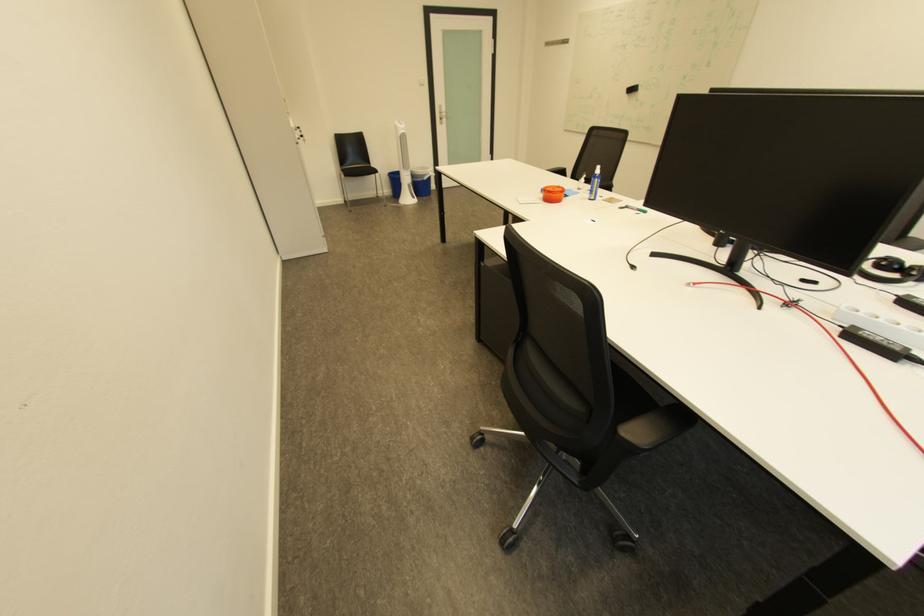
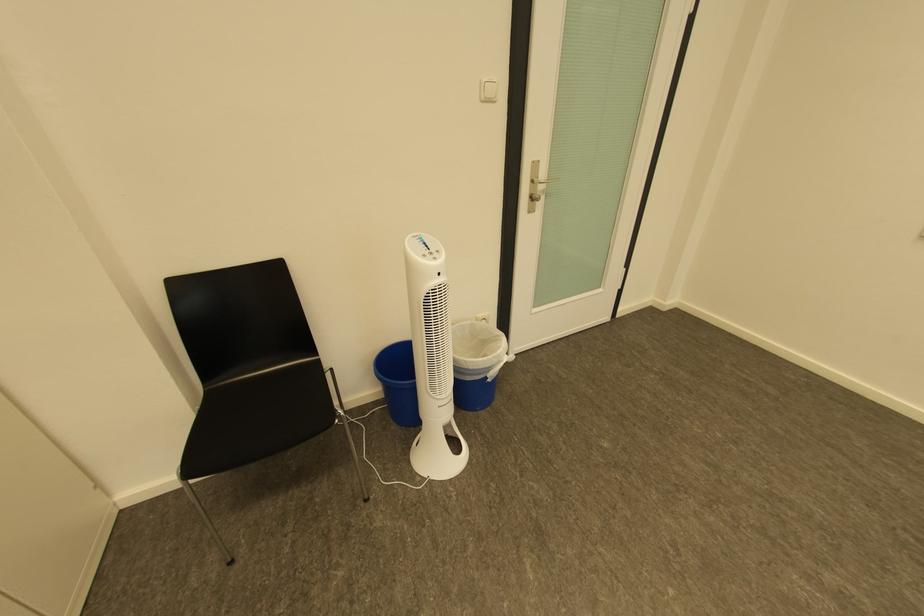
The point at [409,127] is marked in the first image. Where is the corresponding point in the second image?

(439, 262)